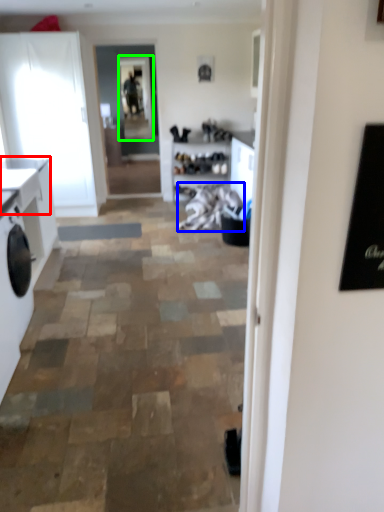
Question: Estimate the real-world distances between objects in this image. Which object is farther from counter top (highlighted by a red box), laundry (highlighted by a blue box) or window screen (highlighted by a green box)?

Choices:
 (A) laundry
 (B) window screen

Answer: (B)